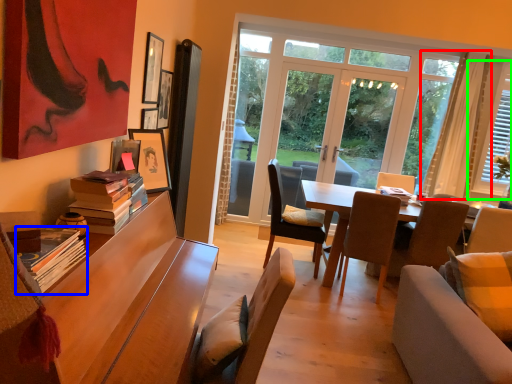
Question: Which object is the closest to the curtain (highlighted by a red box)? Choose among these: book (highlighted by a blue box) or window (highlighted by a green box).

Choices:
 (A) book
 (B) window

Answer: (B)